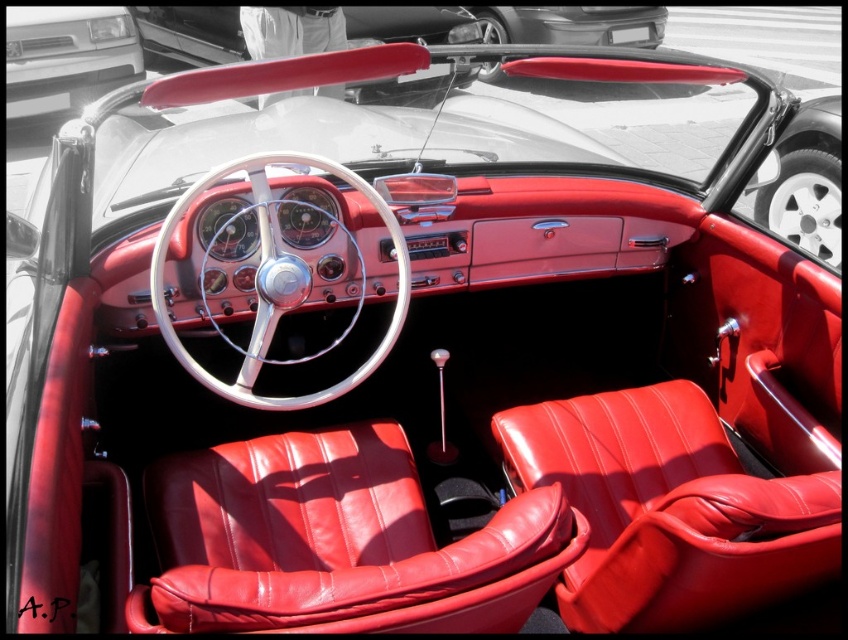
You are a passenger in the convertible and need to reach the matte silver bumper at upper left from the leather seat at center. Considering their heights, will you need to bend down or stand up?

The leather seat at center has a lesser height compared to the matte silver bumper at upper left. Therefore, you will need to stand up to reach the matte silver bumper at upper left from the leather seat at center.

You are sitting in the leather seat at center of a classic convertible car. You want to reach the radio located on the central console. Can you comfortably reach it if your arms are 1.2 meters long?

The distance between the leather seat at center and the radio on the central console is 1.38 meters. Since your arms are only 1.2 meters long, you cannot comfortably reach the radio.

You are a car designer examining the interior of a classic convertible car. You need to locate the shiny leather seat at center. Where exactly is it positioned in the car?

The shiny leather seat at center is positioned at point coordinates of (668, 509).